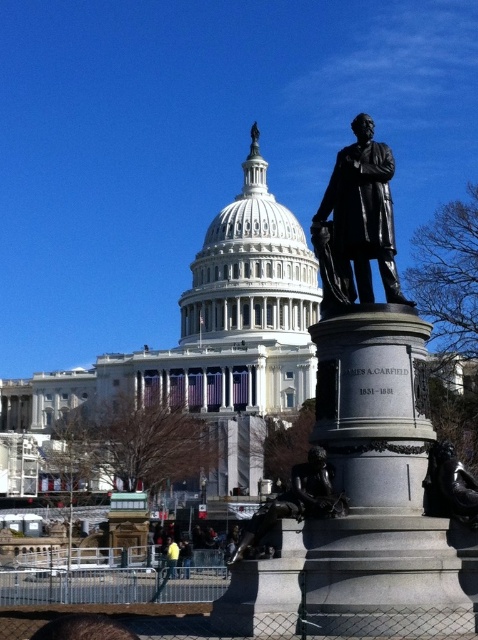
Can you confirm if bronze statue at right is positioned to the right of polished bronze statue at center?

Incorrect, bronze statue at right is not on the right side of polished bronze statue at center.

Can you confirm if bronze statue at right is positioned below polished bronze statue at center?

No, bronze statue at right is not below polished bronze statue at center.

Is point (338, 204) positioned after point (469, 476)?

Yes, it is behind point (469, 476).

At what (x,y) coordinates should I click in order to perform the action: click on bronze statue at right. Please return your answer as a coordinate pair (x, y). Looking at the image, I should click on (358, 221).

Which of these two, polished bronze statue at center or yellow fabric at lower center, stands taller?

yellow fabric at lower center

Between polished bronze statue at center and yellow fabric at lower center, which one appears on the right side from the viewer's perspective?

From the viewer's perspective, polished bronze statue at center appears more on the right side.

The width and height of the screenshot is (478, 640). What do you see at coordinates (448, 486) in the screenshot?
I see `polished bronze statue at center` at bounding box center [448, 486].

Where is `polished bronze statue at center`? This screenshot has height=640, width=478. polished bronze statue at center is located at coordinates (448, 486).

Does bronze statue at center have a smaller size compared to polished bronze statue at center?

Actually, bronze statue at center might be larger than polished bronze statue at center.

Can you confirm if bronze statue at center is taller than polished bronze statue at center?

Yes.

Image resolution: width=478 pixels, height=640 pixels. Identify the location of bronze statue at center. (295, 500).